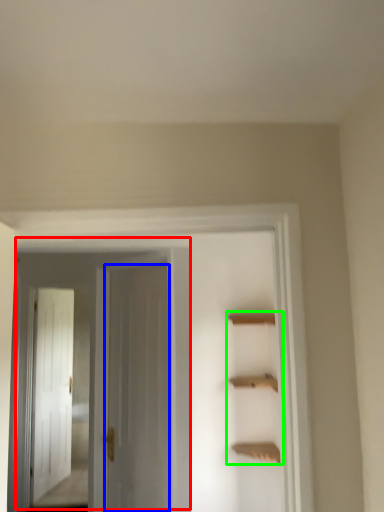
Question: Which is farther away from door (highlighted by a red box)? door (highlighted by a blue box) or cabinet (highlighted by a green box)?

Choices:
 (A) door
 (B) cabinet

Answer: (B)